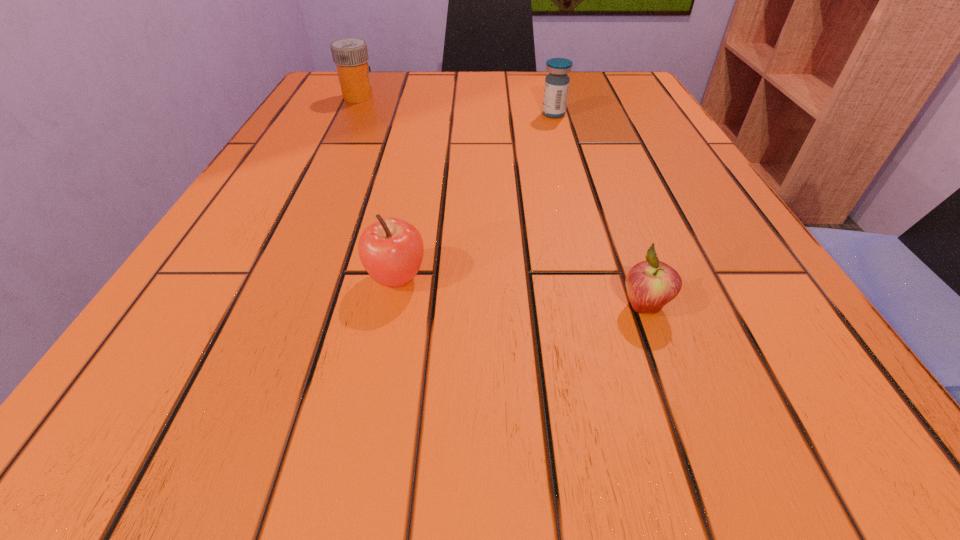
Find the location of a particular element. This screenshot has width=960, height=540. object that is the closest to the farthest object is located at coordinates (556, 88).

In order to click on the third closest object relative to the right apple in this screenshot , I will do `click(350, 55)`.

I want to click on vacant space that satisfies the following two spatial constraints: 1. on the label side of the left medicine; 2. on the left side of the nearer medicine, so click(349, 114).

The height and width of the screenshot is (540, 960). Find the location of `vacant space that satisfies the following two spatial constraints: 1. on the label side of the right apple; 2. on the right side of the farther medicine`. vacant space that satisfies the following two spatial constraints: 1. on the label side of the right apple; 2. on the right side of the farther medicine is located at coordinates (254, 306).

This screenshot has width=960, height=540. What are the coordinates of `vacant area in the image that satisfies the following two spatial constraints: 1. on the label side of the farthest object; 2. on the right side of the right apple` in the screenshot? It's located at point(254,306).

Where is `blank space that satisfies the following two spatial constraints: 1. on the label side of the right apple; 2. on the left side of the leftmost object`? This screenshot has width=960, height=540. blank space that satisfies the following two spatial constraints: 1. on the label side of the right apple; 2. on the left side of the leftmost object is located at coordinates (254, 306).

At what (x,y) coordinates should I click in order to perform the action: click on vacant space that satisfies the following two spatial constraints: 1. on the label side of the left medicine; 2. on the left side of the third object from right to left. Please return your answer as a coordinate pair (x, y). The image size is (960, 540). Looking at the image, I should click on (269, 278).

The height and width of the screenshot is (540, 960). What are the coordinates of `vacant region that satisfies the following two spatial constraints: 1. on the label side of the leftmost object; 2. on the left side of the right apple` in the screenshot? It's located at (254, 306).

Locate an element on the screen. free point that satisfies the following two spatial constraints: 1. on the back side of the right medicine; 2. on the right side of the left apple is located at coordinates (428, 114).

Find the location of a particular element. Image resolution: width=960 pixels, height=540 pixels. free location that satisfies the following two spatial constraints: 1. on the label side of the leftmost object; 2. on the back side of the nearer medicine is located at coordinates point(349,114).